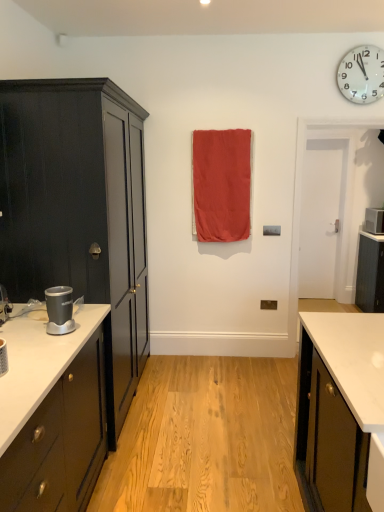
Question: Should I look upward or downward to see matte red fabric at center?

Choices:
 (A) down
 (B) up

Answer: (B)

Question: Is white plastic wall clock at upper right turned away from matte red fabric at center?

Choices:
 (A) no
 (B) yes

Answer: (A)

Question: Does white plastic wall clock at upper right appear on the left side of matte red fabric at center?

Choices:
 (A) yes
 (B) no

Answer: (B)

Question: From a real-world perspective, is white plastic wall clock at upper right on top of matte red fabric at center?

Choices:
 (A) yes
 (B) no

Answer: (A)

Question: From a real-world perspective, is white plastic wall clock at upper right positioned under matte red fabric at center based on gravity?

Choices:
 (A) yes
 (B) no

Answer: (B)

Question: Is white plastic wall clock at upper right to the right of matte red fabric at center from the viewer's perspective?

Choices:
 (A) yes
 (B) no

Answer: (A)

Question: Is white plastic wall clock at upper right positioned far away from matte red fabric at center?

Choices:
 (A) yes
 (B) no

Answer: (A)

Question: From a real-world perspective, does matte black cabinet at left, positioned as the 1th cabinetry in front-to-back order, sit lower than silver metallic blender at left, which is the first appliance in bottom-to-top order?

Choices:
 (A) yes
 (B) no

Answer: (B)

Question: From a real-world perspective, is matte black cabinet at left, which ranks as the first cabinetry in left-to-right order, over silver metallic blender at left, positioned as the second appliance in top-to-bottom order?

Choices:
 (A) no
 (B) yes

Answer: (B)

Question: Considering the relative sizes of matte black cabinet at left, which appears as the second cabinetry when viewed from the right, and silver metallic blender at left, which is the first appliance in bottom-to-top order, in the image provided, is matte black cabinet at left, which appears as the second cabinetry when viewed from the right, thinner than silver metallic blender at left, which is the first appliance in bottom-to-top order,?

Choices:
 (A) yes
 (B) no

Answer: (B)

Question: From the image's perspective, does matte black cabinet at left, which appears as the second cabinetry when viewed from the right, appear higher than silver metallic blender at left, the first appliance positioned from the front?

Choices:
 (A) yes
 (B) no

Answer: (A)

Question: Would you consider matte black cabinet at left, positioned as the 1th cabinetry in front-to-back order, to be distant from silver metallic blender at left, which is the first appliance in bottom-to-top order?

Choices:
 (A) no
 (B) yes

Answer: (A)

Question: Does matte black cabinet at left, which ranks as the first cabinetry in left-to-right order, have a lesser height compared to silver metallic blender at left, which appears as the first appliance when viewed from the left?

Choices:
 (A) no
 (B) yes

Answer: (A)

Question: Is silver metallic blender at left, positioned as the second appliance in top-to-bottom order, turned away from white plastic microwave at right, placed as the second appliance when sorted from left to right?

Choices:
 (A) no
 (B) yes

Answer: (A)